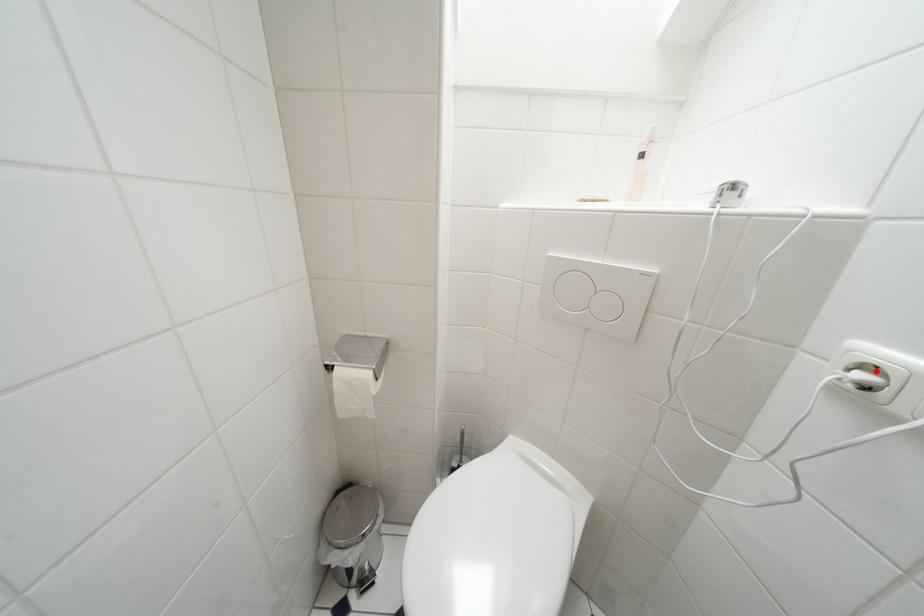
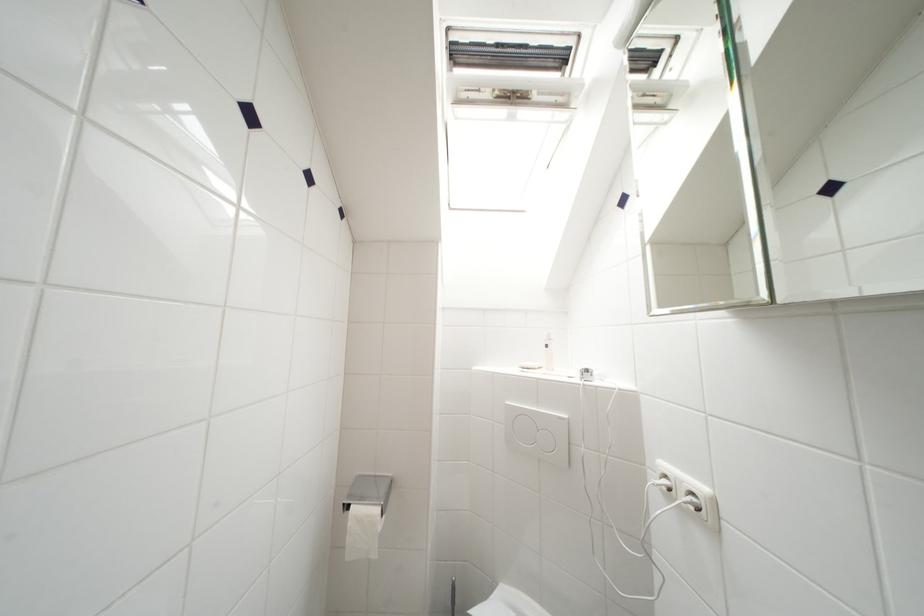
Question: I am providing you with two images of the same scene from different viewpoints. A red point is marked on the first image. Can you still see the location of the red point in image 2?

Choices:
 (A) Yes
 (B) No

Answer: (A)